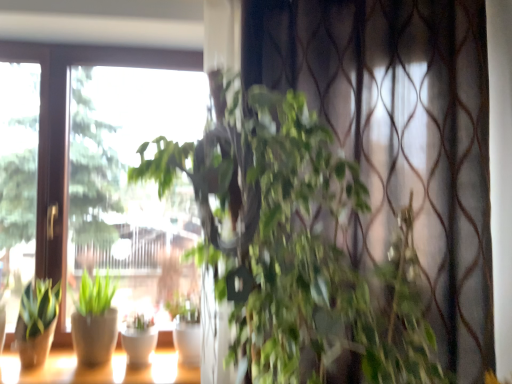
Describe the element at coordinates (139, 345) in the screenshot. Image resolution: width=512 pixels, height=384 pixels. I see `white glossy flowerpot at center` at that location.

In order to face white glossy flowerpot at center, should I rotate leftwards or rightwards?

Turn left approximately 15.251 degrees to face it.

Find the location of `green matte plant at lower left, arranged as the 3th houseplant when viewed from the right`. green matte plant at lower left, arranged as the 3th houseplant when viewed from the right is located at coordinates (37, 322).

From a real-world perspective, who is located lower, green matte plant at center, which appears as the 1th houseplant when viewed from the back, or matte white pots at lower left?

From a 3D spatial view, matte white pots at lower left is below.

Is green matte plant at center, which ranks as the second houseplant in left-to-right order, next to matte white pots at lower left and touching it?

green matte plant at center, which ranks as the second houseplant in left-to-right order, is not next to matte white pots at lower left, and they're not touching.

From the image's perspective, would you say green matte plant at center, the 3th houseplant positioned from the front, is shown under matte white pots at lower left?

Incorrect, from the image's perspective, green matte plant at center, the 3th houseplant positioned from the front, is higher than matte white pots at lower left.

Which point is more forward, (199, 343) or (89, 370)?

Positioned in front is point (199, 343).

Which object is wider, green leafy plant at center, positioned as the 3th houseplant in left-to-right order, or green matte plant at center, which appears as the 1th houseplant when viewed from the back?

With larger width is green leafy plant at center, positioned as the 3th houseplant in left-to-right order.

Can you confirm if green leafy plant at center, marked as the 3th houseplant in a back-to-front arrangement, is shorter than green matte plant at center, which appears as the 1th houseplant when viewed from the back?

In fact, green leafy plant at center, marked as the 3th houseplant in a back-to-front arrangement, may be taller than green matte plant at center, which appears as the 1th houseplant when viewed from the back.

From a real-world perspective, is green leafy plant at center, positioned as the 3th houseplant in left-to-right order, below green matte plant at center, which ranks as the second houseplant in left-to-right order?

No, from a real-world perspective, green leafy plant at center, positioned as the 3th houseplant in left-to-right order, is not under green matte plant at center, which ranks as the second houseplant in left-to-right order.

In the image, is green leafy plant at center, marked as the 3th houseplant in a back-to-front arrangement, positioned in front of or behind green matte plant at center, which ranks as the second houseplant in left-to-right order?

Clearly, green leafy plant at center, marked as the 3th houseplant in a back-to-front arrangement, is in front of green matte plant at center, which ranks as the second houseplant in left-to-right order.

Where is `window lying behind the green leafy plant at center, the 1th houseplant when ordered from front to back`? This screenshot has height=384, width=512. window lying behind the green leafy plant at center, the 1th houseplant when ordered from front to back is located at coordinates (98, 369).

Which is closer, [120,356] or [328,360]?

Positioned in front is point [328,360].

Considering the positions of objects matte white pots at lower left and green leafy plant at center, positioned as the 3th houseplant in left-to-right order, in the image provided, who is behind, matte white pots at lower left or green leafy plant at center, positioned as the 3th houseplant in left-to-right order,?

matte white pots at lower left is behind.

How different are the orientations of matte white pots at lower left and green matte plant at lower left, the 2th houseplant positioned from the front, in degrees?

There is a 1.37-degree angle between the facing directions of matte white pots at lower left and green matte plant at lower left, the 2th houseplant positioned from the front.

Is green matte plant at lower left, the 1th houseplant from the left, located within matte white pots at lower left?

That's incorrect, green matte plant at lower left, the 1th houseplant from the left, is not inside matte white pots at lower left.

Consider the image. Considering their positions, is matte white pots at lower left located in front of or behind green matte plant at lower left, the 1th houseplant from the left?

Clearly, matte white pots at lower left is in front of green matte plant at lower left, the 1th houseplant from the left.

Locate an element on the screen. The height and width of the screenshot is (384, 512). window in front of the green matte plant at lower left, arranged as the 3th houseplant when viewed from the right is located at coordinates (98, 369).

Can you confirm if green leafy plant at center, marked as the 3th houseplant in a back-to-front arrangement, is shorter than green matte plant at lower left, the 2th houseplant positioned from the front?

No, green leafy plant at center, marked as the 3th houseplant in a back-to-front arrangement, is not shorter than green matte plant at lower left, the 2th houseplant positioned from the front.

Is green leafy plant at center, marked as the 3th houseplant in a back-to-front arrangement, facing away from green matte plant at lower left, the 2th houseplant positioned from the front?

No, green leafy plant at center, marked as the 3th houseplant in a back-to-front arrangement, is not facing the opposite direction of green matte plant at lower left, the 2th houseplant positioned from the front.

From the picture: Does green leafy plant at center, positioned as the 3th houseplant in left-to-right order, appear on the left side of green matte plant at lower left, the 2th houseplant positioned from the front?

No, green leafy plant at center, positioned as the 3th houseplant in left-to-right order, is not to the left of green matte plant at lower left, the 2th houseplant positioned from the front.

How different are the orientations of green leafy plant at center, positioned as the 3th houseplant in left-to-right order, and green matte plant at lower left, the 1th houseplant from the left, in degrees?

The angular difference between green leafy plant at center, positioned as the 3th houseplant in left-to-right order, and green matte plant at lower left, the 1th houseplant from the left, is 58.8 degrees.

Which is nearer, (341, 224) or (133, 356)?

The point (341, 224) is in front.

Is green leafy plant at center, positioned as the 3th houseplant in left-to-right order, with white glossy flowerpot at center?

No, green leafy plant at center, positioned as the 3th houseplant in left-to-right order, is not with white glossy flowerpot at center.

Is the position of green leafy plant at center, the 1th houseplant from the right, more distant than that of white glossy flowerpot at center?

No, green leafy plant at center, the 1th houseplant from the right, is closer to the viewer.

Can white glossy flowerpot at center be found inside green leafy plant at center, the 1th houseplant when ordered from front to back?

No, white glossy flowerpot at center is not a part of green leafy plant at center, the 1th houseplant when ordered from front to back.

From the image's perspective, is white glossy flowerpot at center below green matte plant at center, the 3th houseplant positioned from the front?

Yes.

Considering the relative sizes of white glossy flowerpot at center and green matte plant at center, which is the 2th houseplant from right to left, in the image provided, is white glossy flowerpot at center bigger than green matte plant at center, which is the 2th houseplant from right to left,?

Incorrect, white glossy flowerpot at center is not larger than green matte plant at center, which is the 2th houseplant from right to left.

Would you consider white glossy flowerpot at center to be distant from green matte plant at center, which is the 2th houseplant from right to left?

No, white glossy flowerpot at center is not far from green matte plant at center, which is the 2th houseplant from right to left.

Locate an element on the screen. The width and height of the screenshot is (512, 384). window that appears below the green matte plant at center, which is the 2th houseplant from right to left (from the image's perspective) is located at coordinates (x=98, y=369).

What are the coordinates of `the 1st houseplant to the left of the green leafy plant at center, the 1th houseplant from the right, counting from the anchor's position` in the screenshot? It's located at (185, 328).

From the image, which object appears to be farther from green leafy plant at center, the 1th houseplant when ordered from front to back, green matte plant at lower left, the 2th houseplant positioned from the front, or matte white pots at lower left?

The object further to green leafy plant at center, the 1th houseplant when ordered from front to back, is green matte plant at lower left, the 2th houseplant positioned from the front.

From the image, which object appears to be farther from white glossy flowerpot at center, matte white pots at lower left or green matte plant at lower left, which is the second houseplant from back to front?

green matte plant at lower left, which is the second houseplant from back to front, is further to white glossy flowerpot at center.

In the scene shown: When comparing their distances from matte white pots at lower left, does green matte plant at center, which appears as the 1th houseplant when viewed from the back, or green leafy plant at center, positioned as the 3th houseplant in left-to-right order, seem closer?

green matte plant at center, which appears as the 1th houseplant when viewed from the back, is positioned closer to the anchor matte white pots at lower left.

Looking at the image, which one is located further to green leafy plant at center, positioned as the 3th houseplant in left-to-right order, white glossy flowerpot at center or green matte plant at center, which is the 2th houseplant from right to left?

white glossy flowerpot at center lies further to green leafy plant at center, positioned as the 3th houseplant in left-to-right order, than the other object.

From the image, which object appears to be farther from green leafy plant at center, positioned as the 3th houseplant in left-to-right order, matte white pots at lower left or green matte plant at center, which ranks as the second houseplant in left-to-right order?

matte white pots at lower left lies further to green leafy plant at center, positioned as the 3th houseplant in left-to-right order, than the other object.

From the image, which object appears to be farther from green matte plant at lower left, the 1th houseplant from the left, white glossy flowerpot at center or green matte plant at center, which appears as the 1th houseplant when viewed from the back?

green matte plant at center, which appears as the 1th houseplant when viewed from the back, lies further to green matte plant at lower left, the 1th houseplant from the left, than the other object.

Which object lies further to the anchor point green leafy plant at center, positioned as the 3th houseplant in left-to-right order, green matte plant at lower left, arranged as the 3th houseplant when viewed from the right, or green matte plant at center, which is the 2th houseplant from right to left?

green matte plant at lower left, arranged as the 3th houseplant when viewed from the right.

Considering their positions, is green matte plant at center, which appears as the 1th houseplant when viewed from the back, positioned closer to matte white pots at lower left than green matte plant at lower left, the 2th houseplant positioned from the front?

green matte plant at lower left, the 2th houseplant positioned from the front.

This screenshot has width=512, height=384. I want to click on window located between green leafy plant at center, the 1th houseplant when ordered from front to back, and white glossy flowerpot at center in the depth direction, so click(98, 369).

The width and height of the screenshot is (512, 384). Identify the location of houseplant positioned between green leafy plant at center, the 1th houseplant from the right, and green matte plant at center, which ranks as the second houseplant in left-to-right order, from near to far. (37, 322).

Identify the location of window between green leafy plant at center, the 1th houseplant when ordered from front to back, and green matte plant at center, which ranks as the second houseplant in left-to-right order, from front to back. Image resolution: width=512 pixels, height=384 pixels. (98, 369).

The height and width of the screenshot is (384, 512). Identify the location of window between green matte plant at lower left, which is the second houseplant from back to front, and green matte plant at center, which ranks as the second houseplant in left-to-right order, in the horizontal direction. (98, 369).